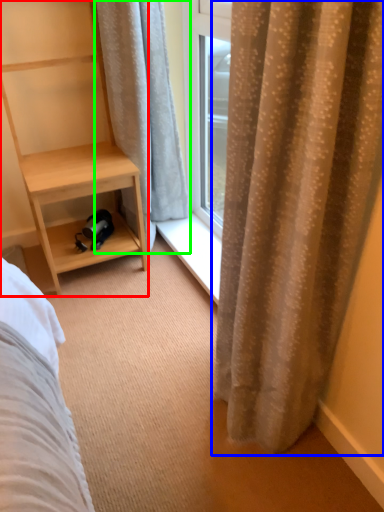
Question: Estimate the real-world distances between objects in this image. Which object is closer to shelf (highlighted by a red box), curtain (highlighted by a blue box) or curtain (highlighted by a green box)?

Choices:
 (A) curtain
 (B) curtain

Answer: (B)